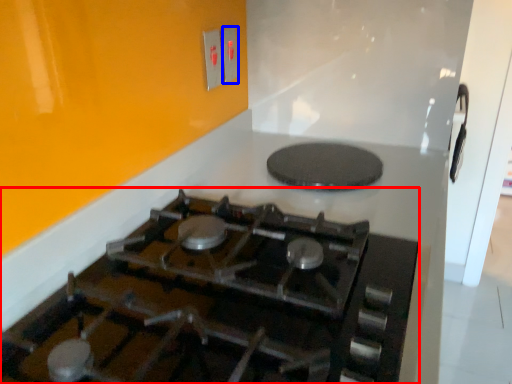
Question: Which object is closer to the camera taking this photo, gas stove (highlighted by a red box) or electric outlet (highlighted by a blue box)?

Choices:
 (A) gas stove
 (B) electric outlet

Answer: (A)